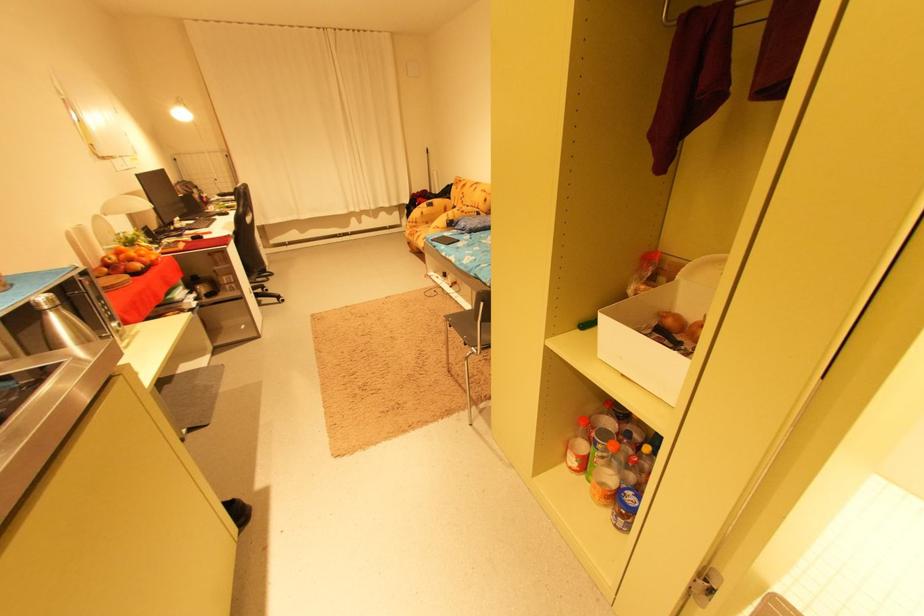
The location [473,223] corresponds to which object?

This point indicates the blue pillow.